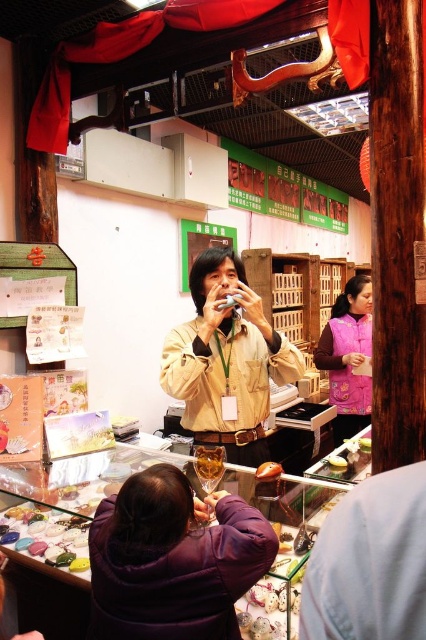
Does translucent glass at center have a larger size compared to yellow matte cake at center?

Yes, translucent glass at center is bigger than yellow matte cake at center.

Is translucent glass at center thinner than yellow matte cake at center?

Incorrect, translucent glass at center's width is not less than yellow matte cake at center's.

Image resolution: width=426 pixels, height=640 pixels. Describe the element at coordinates (209, 465) in the screenshot. I see `translucent glass at center` at that location.

Image resolution: width=426 pixels, height=640 pixels. I want to click on translucent glass at center, so pos(209,465).

Is pink fleece vest at center closer to camera compared to translucent glass at center?

No, it is not.

Find the location of a particular element. Image resolution: width=426 pixels, height=640 pixels. pink fleece vest at center is located at coordinates (348, 356).

Is translucent glass at center further to camera compared to orange glossy candy at center?

That is False.

From the picture: Who is more forward, (198, 468) or (273, 480)?

Point (198, 468) is in front.

The height and width of the screenshot is (640, 426). What do you see at coordinates (209, 465) in the screenshot?
I see `translucent glass at center` at bounding box center [209, 465].

Image resolution: width=426 pixels, height=640 pixels. I want to click on translucent glass at center, so click(x=209, y=465).